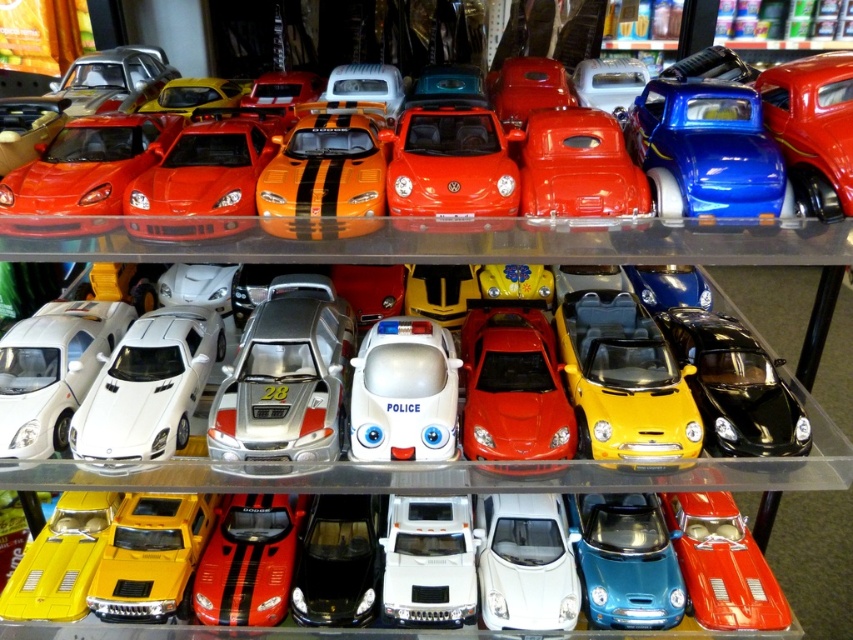
Question: Can you confirm if white glossy police car at center is positioned to the right of white glossy sports car at center?

Choices:
 (A) no
 (B) yes

Answer: (A)

Question: Which point appears closest to the camera in this image?

Choices:
 (A) (434, 323)
 (B) (363, 522)
 (C) (59, 348)

Answer: (C)

Question: Where is silver metallic race car at center located in relation to yellow metallic car at lower left in the image?

Choices:
 (A) right
 (B) left

Answer: (A)

Question: Among these objects, which one is nearest to the camera?

Choices:
 (A) yellow matte car at center
 (B) white plastic truck at center
 (C) shiny red car at center

Answer: (A)

Question: Which object is farther from the camera taking this photo?

Choices:
 (A) white matte sports car at left
 (B) shiny black car at center-right
 (C) glossy orange car at upper center

Answer: (B)

Question: Can you confirm if white matte car at center is wider than shiny red car at center?

Choices:
 (A) yes
 (B) no

Answer: (B)